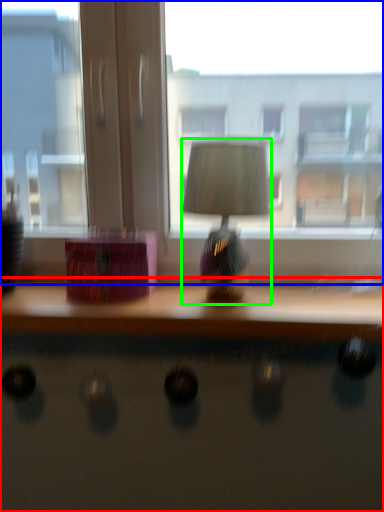
Question: Which object is positioned closest to desk (highlighted by a red box)? Select from window (highlighted by a blue box) and table lamp (highlighted by a green box).

Choices:
 (A) window
 (B) table lamp

Answer: (B)